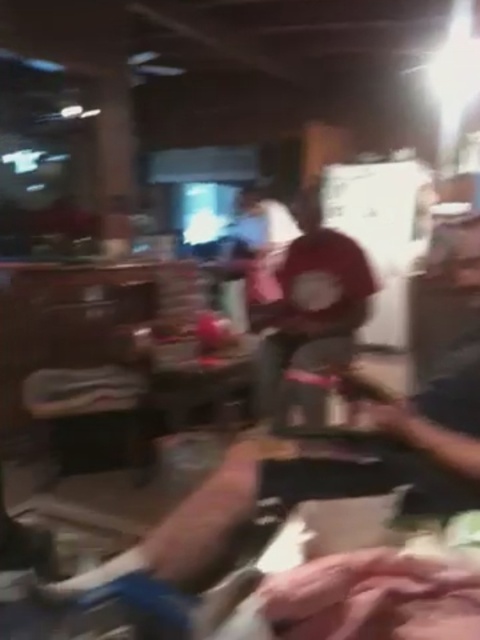
Measure the distance between point (348, 305) and camera.

Point (348, 305) is 10.98 feet from camera.

Image resolution: width=480 pixels, height=640 pixels. I want to click on red cotton shirt at center, so click(x=311, y=305).